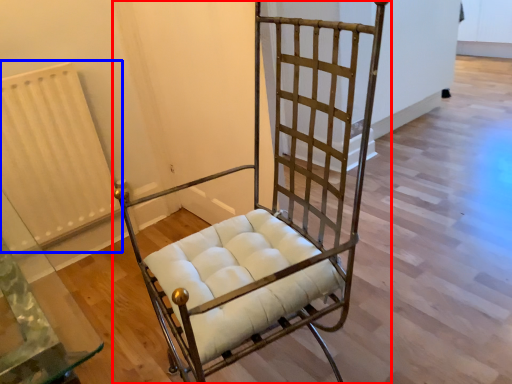
Question: Which of the following is the closest to the observer, furniture (highlighted by a red box) or radiator (highlighted by a blue box)?

Choices:
 (A) furniture
 (B) radiator

Answer: (A)